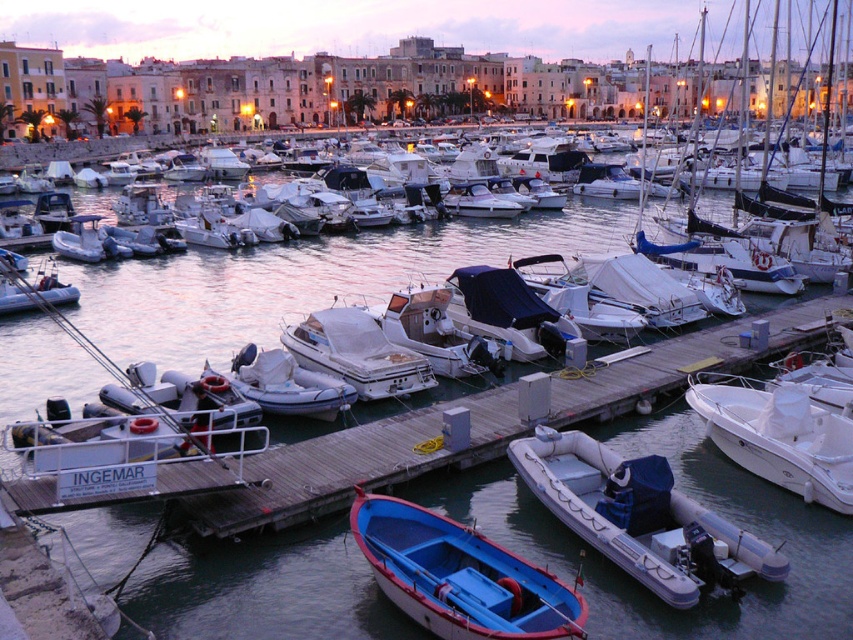
You are standing at the point where the small blue and red motorboat is located. Looking towards the rubber dinghy at lower right, which is represented by point (639, 516), in the marina scene, what direction should you face to see the rubber dinghy at lower right?

The rubber dinghy at lower right is located at point (639, 516), so you should face towards the lower right direction to see it.

You are standing at the center of the image and want to move towards the rubber dinghy at lower right. Which direction should you move in?

Since the rubber dinghy at lower right is located at point [639,516] in the 2D space, you should move towards the lower right direction to reach it.

You are standing on the wooden dock at center and want to reach the blue matte rowboat at center. Which direction should you move to get there?

The blue matte rowboat at center is behind the wooden dock at center, so you should move backward to reach it.